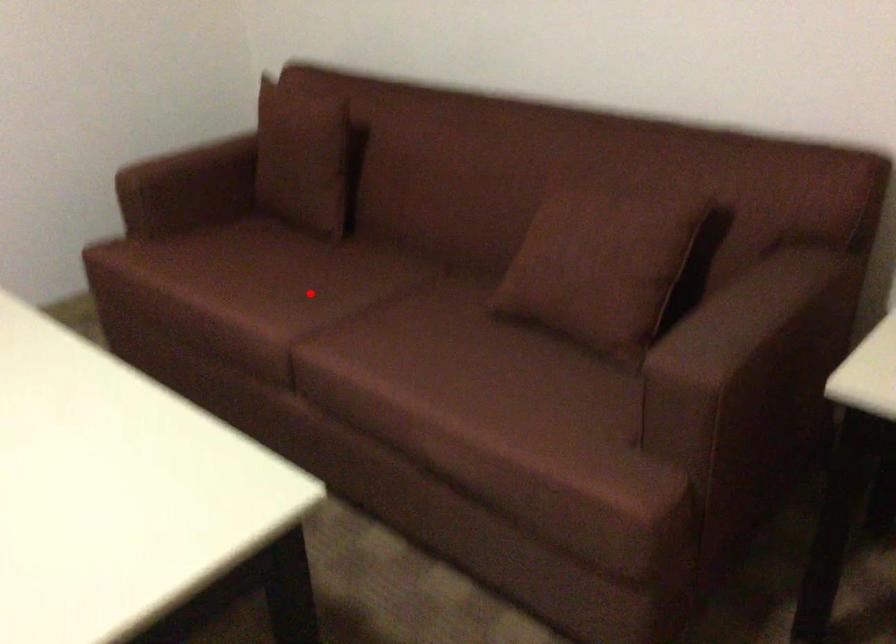
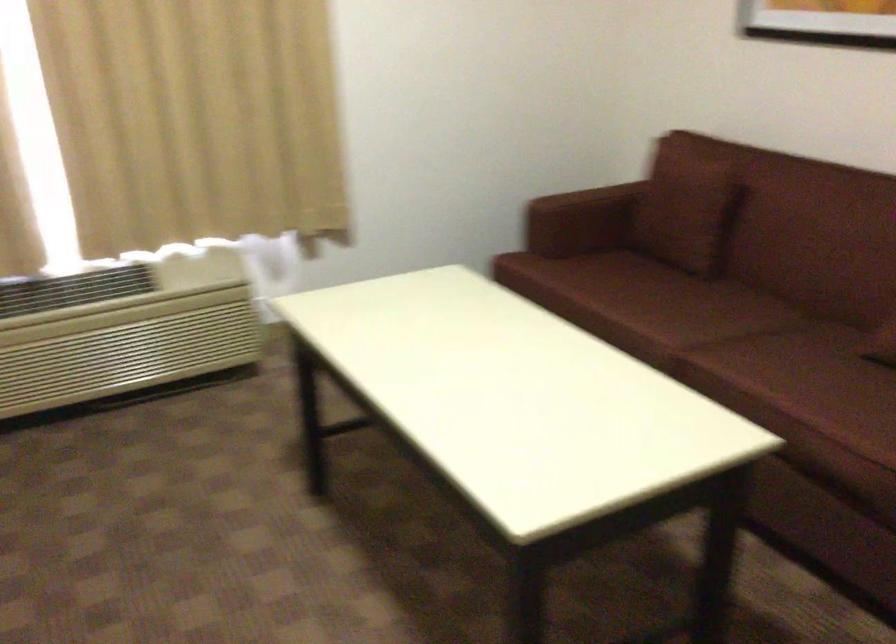
Question: I am providing you with two images of the same scene from different viewpoints. Given a red point in image1, look at the same physical point in image2. Is it:

Choices:
 (A) Closer to the viewpoint
 (B) Farther from the viewpoint

Answer: (B)